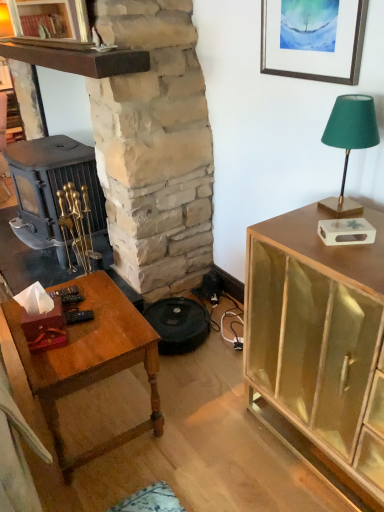
Locate an element on the screen. The image size is (384, 512). vacant space situated on the left part of matte gold cabinet at right is located at coordinates (213, 437).